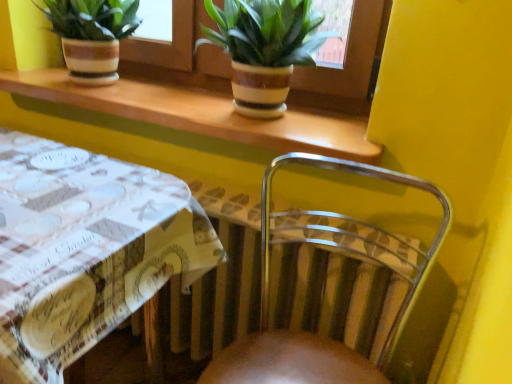
Where is `vacant area that is situated to the right of green leafy plant in striped pot at upper center, the first houseplant positioned from the right`? The width and height of the screenshot is (512, 384). vacant area that is situated to the right of green leafy plant in striped pot at upper center, the first houseplant positioned from the right is located at coordinates (339, 133).